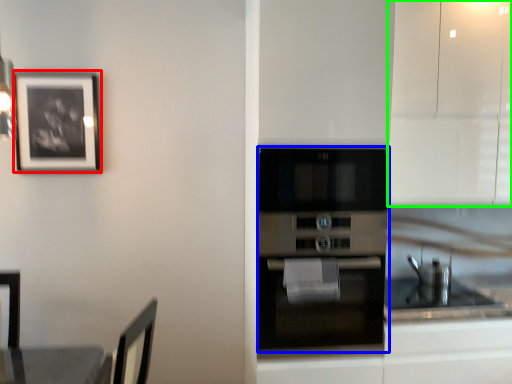
Question: Which object is positioned closest to picture frame (highlighted by a red box)? Select from oven (highlighted by a blue box) and cabinetry (highlighted by a green box).

Choices:
 (A) oven
 (B) cabinetry

Answer: (A)